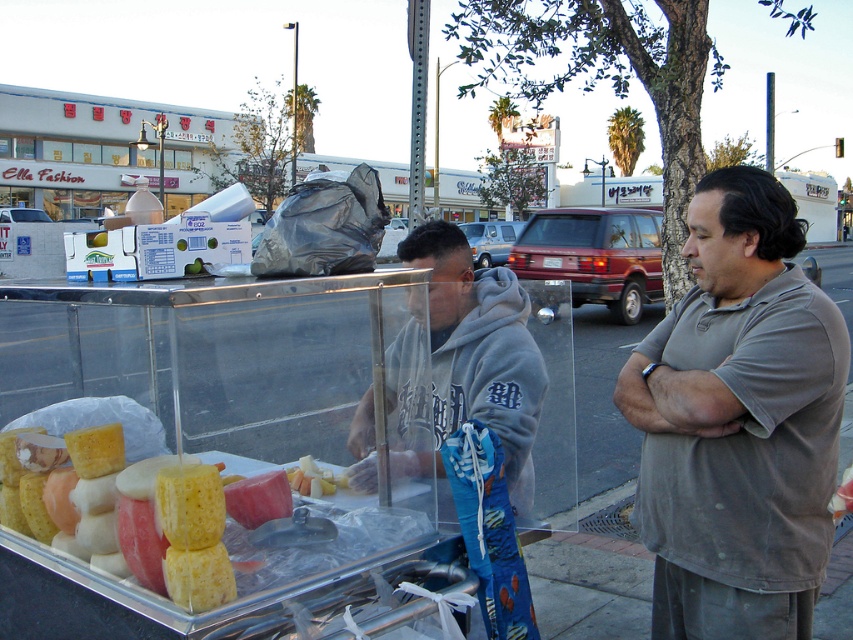
Question: Which point is closer to the camera taking this photo?

Choices:
 (A) (764, 266)
 (B) (434, 337)

Answer: (A)

Question: Which of the following is the closest to the observer?

Choices:
 (A) (787, 445)
 (B) (372, 474)

Answer: (A)

Question: Is gray cotton shirt at right behind gray fleece hoodie at center?

Choices:
 (A) no
 (B) yes

Answer: (B)

Question: Is gray cotton shirt at right thinner than gray fleece hoodie at center?

Choices:
 (A) yes
 (B) no

Answer: (A)

Question: Can you confirm if gray cotton shirt at right is wider than gray fleece hoodie at center?

Choices:
 (A) no
 (B) yes

Answer: (A)

Question: Among these points, which one is nearest to the camera?

Choices:
 (A) (701, 490)
 (B) (498, 480)

Answer: (B)